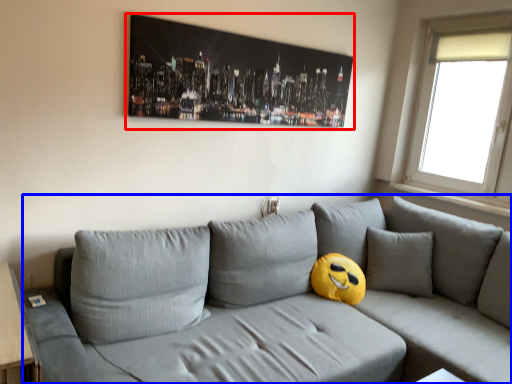
Question: Which of the following is the closest to the observer, picture frame (highlighted by a red box) or studio couch (highlighted by a blue box)?

Choices:
 (A) picture frame
 (B) studio couch

Answer: (B)